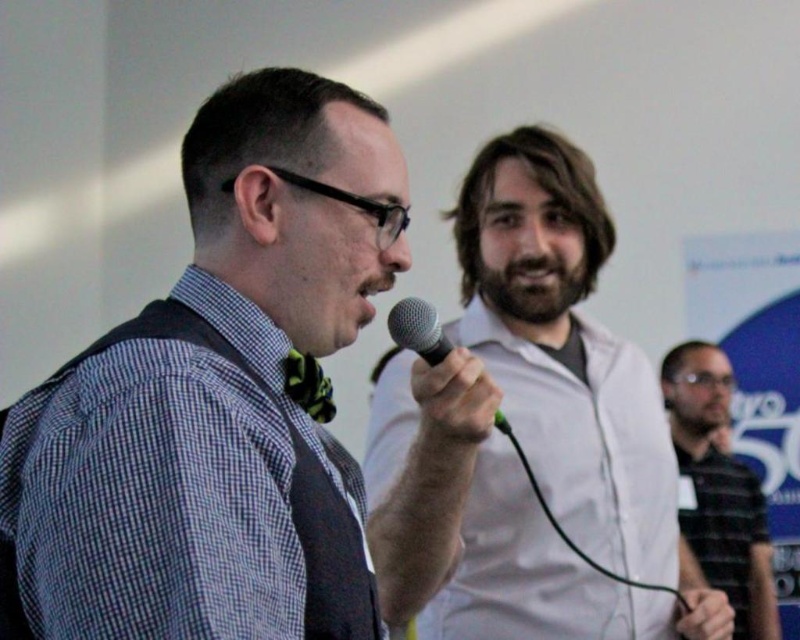
Question: Which point is closer to the camera?

Choices:
 (A) striped cotton shirt at right
 (B) checkered fabric shirt at center
 (C) green patterned bow tie at center

Answer: (B)

Question: Can you confirm if striped cotton shirt at right is positioned to the left of black metallic microphone at center?

Choices:
 (A) yes
 (B) no

Answer: (B)

Question: Estimate the real-world distances between objects in this image. Which object is closer to the striped cotton shirt at right?

Choices:
 (A) checkered fabric shirt at center
 (B) black metallic microphone at center
 (C) green patterned bow tie at center

Answer: (B)

Question: Which object appears farthest from the camera in this image?

Choices:
 (A) white matte shirt at center
 (B) checkered fabric shirt at center
 (C) green patterned bow tie at center
 (D) black metallic microphone at center

Answer: (A)

Question: Is checkered fabric shirt at center bigger than white matte shirt at center?

Choices:
 (A) yes
 (B) no

Answer: (B)

Question: Does striped cotton shirt at right appear over green patterned bow tie at center?

Choices:
 (A) no
 (B) yes

Answer: (A)